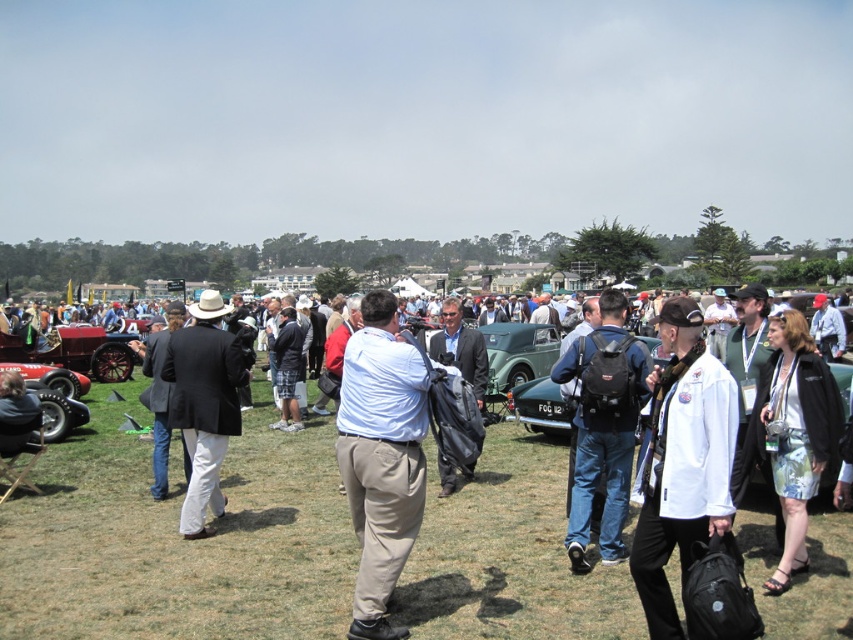
Does light blue shirt at center have a lesser width compared to matte black backpack at center?

Correct, light blue shirt at center's width is less than matte black backpack at center's.

Which is in front, point (364, 365) or point (640, 378)?

Point (364, 365)

Measure the distance between light blue shirt at center and camera.

light blue shirt at center and camera are 5.59 meters apart from each other.

The height and width of the screenshot is (640, 853). I want to click on light blue shirt at center, so click(x=381, y=456).

Does point (196, 458) come farther from viewer compared to point (714, 307)?

No, (196, 458) is in front of (714, 307).

In the scene shown: Who is higher up, black wool suit at center or white uniform at center?

white uniform at center is above.

Who is more distant from viewer, (190, 362) or (718, 317)?

Point (718, 317)

At what (x,y) coordinates should I click in order to perform the action: click on black wool suit at center. Please return your answer as a coordinate pair (x, y). This screenshot has width=853, height=640. Looking at the image, I should click on (204, 404).

Between floral skirt at center and matte black bag at center, which one appears on the right side from the viewer's perspective?

Positioned to the right is floral skirt at center.

Does floral skirt at center lie in front of matte black bag at center?

No, it is behind matte black bag at center.

The height and width of the screenshot is (640, 853). What are the coordinates of `floral skirt at center` in the screenshot? It's located at (798, 433).